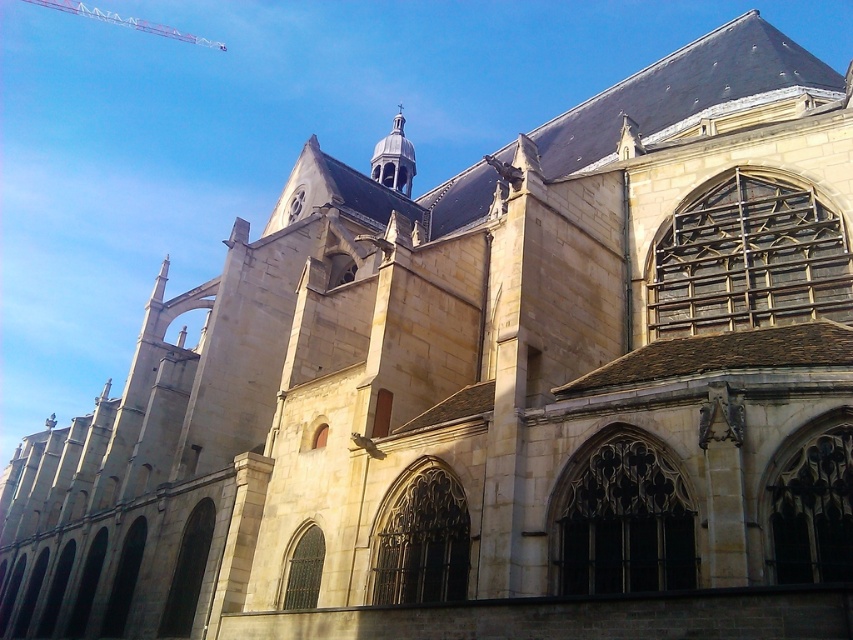
You are an architect assessing the structural integrity of the historic stone building. You notice the smooth gray spire at upper center and the metallic red crane at upper left. Which object has a narrower width?

The smooth gray spire at upper center has a lesser width compared to the metallic red crane at upper left, so the smooth gray spire at upper center is narrower in width.

You are a drone operator tasked with capturing aerial footage of the historic stone building. Your drone has a maximum flight range of 120 meters. If you are positioned at the camera location, can your drone safely reach the smooth gray spire at upper center to film it without exceeding its range limit?

The smooth gray spire at upper center is 125.72 meters away from the camera, which exceeds the drone operator drone maximum flight range of 120 meters. Therefore, the drone cannot safely reach the smooth gray spire at upper center without exceeding its range limit.

You are standing in front of a historic stone building. There is a point at coordinates point (392, 166). Can you estimate how far you are from that point?

The distance between point (392, 166) and the viewer is 136.32 meters.